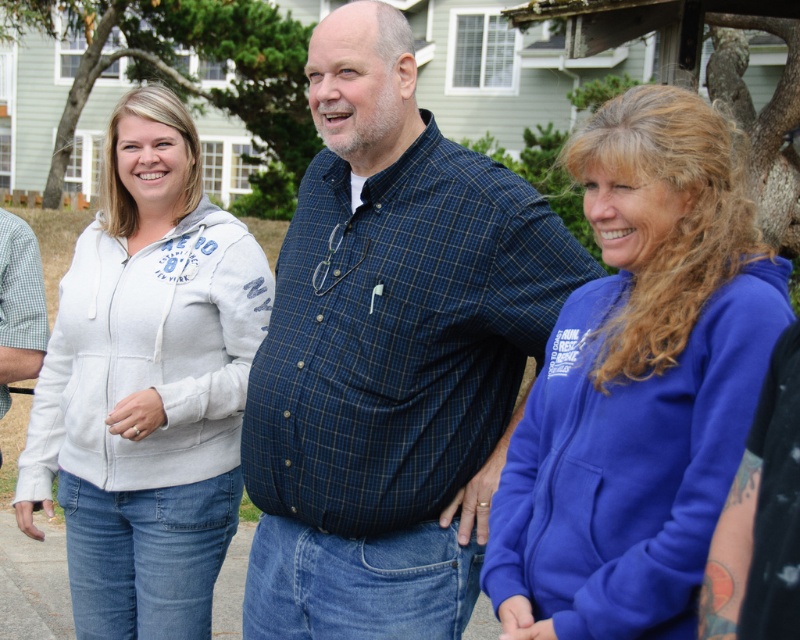
Question: Does blue plaid shirt at center come behind white gingham shirt at left?

Choices:
 (A) no
 (B) yes

Answer: (A)

Question: Which object is positioned farthest from the light gray fleece jacket at center?

Choices:
 (A) white gingham shirt at left
 (B) blue plaid shirt at center

Answer: (B)

Question: Which point appears farthest from the camera in this image?

Choices:
 (A) (518, 244)
 (B) (42, 291)

Answer: (B)

Question: Is blue fleece jacket at right to the right of white gingham shirt at left from the viewer's perspective?

Choices:
 (A) no
 (B) yes

Answer: (B)

Question: Among these points, which one is farthest from the camera?

Choices:
 (A) (40, 262)
 (B) (262, 264)
 (C) (556, 624)
 (D) (384, 346)

Answer: (A)

Question: Does blue plaid shirt at center appear under light gray fleece jacket at center?

Choices:
 (A) yes
 (B) no

Answer: (B)